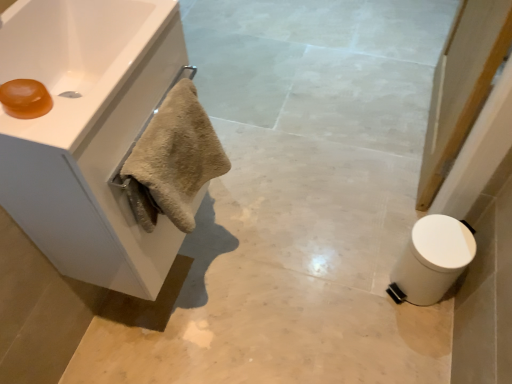
This screenshot has width=512, height=384. Describe the element at coordinates (173, 160) in the screenshot. I see `beige fluffy towel at left` at that location.

In order to face white matte trash can at lower right, should I rotate leftwards or rightwards?

Rotate right and turn 21.598 degrees.

Image resolution: width=512 pixels, height=384 pixels. Find the location of `white matte trash can at lower right`. white matte trash can at lower right is located at coordinates (432, 260).

You are a GUI agent. You are given a task and a screenshot of the screen. Output one action in this format:
    pyautogui.click(x=<x>, y=<y>)
    Task: Click on the translucent amber soap at upper left
    
    Given the screenshot: What is the action you would take?
    pyautogui.click(x=25, y=98)

Would you say beige fluffy towel at left is outside translucent amber soap at upper left?

Yes, beige fluffy towel at left is located beyond the bounds of translucent amber soap at upper left.

Does beige fluffy towel at left come behind translucent amber soap at upper left?

Yes, beige fluffy towel at left is behind translucent amber soap at upper left.

Looking at the image, does beige fluffy towel at left seem bigger or smaller compared to translucent amber soap at upper left?

In the image, beige fluffy towel at left appears to be larger than translucent amber soap at upper left.

Visually, is beige fluffy towel at left positioned to the left or to the right of translucent amber soap at upper left?

Clearly, beige fluffy towel at left is on the right of translucent amber soap at upper left in the image.

Who is smaller, translucent amber soap at upper left or white glossy sink at upper left?

translucent amber soap at upper left is smaller.

Locate an element on the screen. soap on the left of white glossy sink at upper left is located at coordinates (25, 98).

Based on the photo, from their relative heights in the image, would you say translucent amber soap at upper left is taller or shorter than white glossy sink at upper left?

In the image, translucent amber soap at upper left appears to be shorter than white glossy sink at upper left.

Is translucent amber soap at upper left positioned beyond the bounds of white glossy sink at upper left?

No, translucent amber soap at upper left is not outside of white glossy sink at upper left.

From the picture: From the image's perspective, is white glossy sink at upper left located above or below white matte cabinet at upper left?

Based on their image positions, white glossy sink at upper left is located above white matte cabinet at upper left.

From their relative heights in the image, would you say white glossy sink at upper left is taller or shorter than white matte cabinet at upper left?

Clearly, white glossy sink at upper left is shorter compared to white matte cabinet at upper left.

Consider the image. From a real-world perspective, is white glossy sink at upper left positioned above or below white matte cabinet at upper left?

white glossy sink at upper left is above white matte cabinet at upper left.

Can you confirm if white glossy sink at upper left is wider than white matte cabinet at upper left?

In fact, white glossy sink at upper left might be narrower than white matte cabinet at upper left.

How distant is white matte cabinet at upper left from translucent amber soap at upper left?

white matte cabinet at upper left is 25.67 centimeters from translucent amber soap at upper left.

From a real-world perspective, which object rests below the other?

From a 3D spatial view, white matte cabinet at upper left is below.

Which object is further away from the camera, white matte cabinet at upper left or translucent amber soap at upper left?

Positioned behind is white matte cabinet at upper left.

Identify the location of bathroom cabinet that is on the right side of translucent amber soap at upper left. (88, 133).

Locate an element on the screen. This screenshot has height=384, width=512. bathroom cabinet lying in front of the white matte trash can at lower right is located at coordinates (88, 133).

Is white matte trash can at lower right facing away from white matte cabinet at upper left?

No, white matte trash can at lower right's orientation is not away from white matte cabinet at upper left.

Considering the relative positions of white matte trash can at lower right and white matte cabinet at upper left in the image provided, is white matte trash can at lower right to the left of white matte cabinet at upper left from the viewer's perspective?

No, white matte trash can at lower right is not to the left of white matte cabinet at upper left.

Considering the sizes of objects white matte trash can at lower right and white matte cabinet at upper left in the image provided, who is shorter, white matte trash can at lower right or white matte cabinet at upper left?

white matte trash can at lower right.

Locate an element on the screen. The image size is (512, 384). concrete below the white glossy sink at upper left (from the image's perspective) is located at coordinates (288, 275).

What's the angular difference between white glossy sink at upper left and white marble towel at left's facing directions?

The angle between the facing direction of white glossy sink at upper left and the facing direction of white marble towel at left is 90.4 degrees.

Does point (87, 97) come behind point (297, 165)?

No.

Does white glossy sink at upper left come behind white marble towel at left?

No, white glossy sink at upper left is in front of white marble towel at left.

How different are the orientations of white marble towel at left and white matte cabinet at upper left in degrees?

white marble towel at left and white matte cabinet at upper left are facing 91.1 degrees away from each other.

Between white marble towel at left and white matte cabinet at upper left, which one is positioned behind?

white marble towel at left is behind.

Can you confirm if white marble towel at left is positioned to the right of white matte cabinet at upper left?

Correct, you'll find white marble towel at left to the right of white matte cabinet at upper left.

From the picture: Is white marble towel at left situated inside white matte cabinet at upper left or outside?

white marble towel at left is located beyond the bounds of white matte cabinet at upper left.

This screenshot has width=512, height=384. I want to click on bath towel that appears on the right of translucent amber soap at upper left, so click(173, 160).

Locate an element on the screen. The width and height of the screenshot is (512, 384). soap above the white glossy sink at upper left (from a real-world perspective) is located at coordinates (25, 98).

Considering their positions, is white glossy sink at upper left positioned closer to white matte trash can at lower right than translucent amber soap at upper left?

white glossy sink at upper left lies closer to white matte trash can at lower right than the other object.

When comparing their distances from beige fluffy towel at left, does translucent amber soap at upper left or white matte cabinet at upper left seem further?

Among the two, translucent amber soap at upper left is located further to beige fluffy towel at left.

Estimate the real-world distances between objects in this image. Which object is further from white matte cabinet at upper left, beige fluffy towel at left or white marble towel at left?

white marble towel at left.

Based on their spatial positions, is white marble towel at left or white matte trash can at lower right closer to white glossy sink at upper left?

white marble towel at left is closer to white glossy sink at upper left.

From the image, which object appears to be farther from white matte trash can at lower right, beige fluffy towel at left or translucent amber soap at upper left?

translucent amber soap at upper left is positioned further to the anchor white matte trash can at lower right.

Based on their spatial positions, is white matte cabinet at upper left or white marble towel at left further from beige fluffy towel at left?

white marble towel at left is further to beige fluffy towel at left.

Based on their spatial positions, is white matte cabinet at upper left or white glossy sink at upper left further from beige fluffy towel at left?

Result: Among the two, white glossy sink at upper left is located further to beige fluffy towel at left.

Considering their positions, is white matte trash can at lower right positioned closer to white marble towel at left than white matte cabinet at upper left?

white matte trash can at lower right is positioned closer to the anchor white marble towel at left.

Locate an element on the screen. This screenshot has width=512, height=384. bath towel situated between white glossy sink at upper left and white matte trash can at lower right from left to right is located at coordinates (173, 160).

Find the location of a particular element. The image size is (512, 384). bath towel between translucent amber soap at upper left and white marble towel at left vertically is located at coordinates (173, 160).

The width and height of the screenshot is (512, 384). I want to click on concrete located between white glossy sink at upper left and white matte trash can at lower right in the left-right direction, so click(288, 275).

Find the location of `bathroom cabinet between translucent amber soap at upper left and white matte trash can at lower right in the horizontal direction`. bathroom cabinet between translucent amber soap at upper left and white matte trash can at lower right in the horizontal direction is located at coordinates (88, 133).